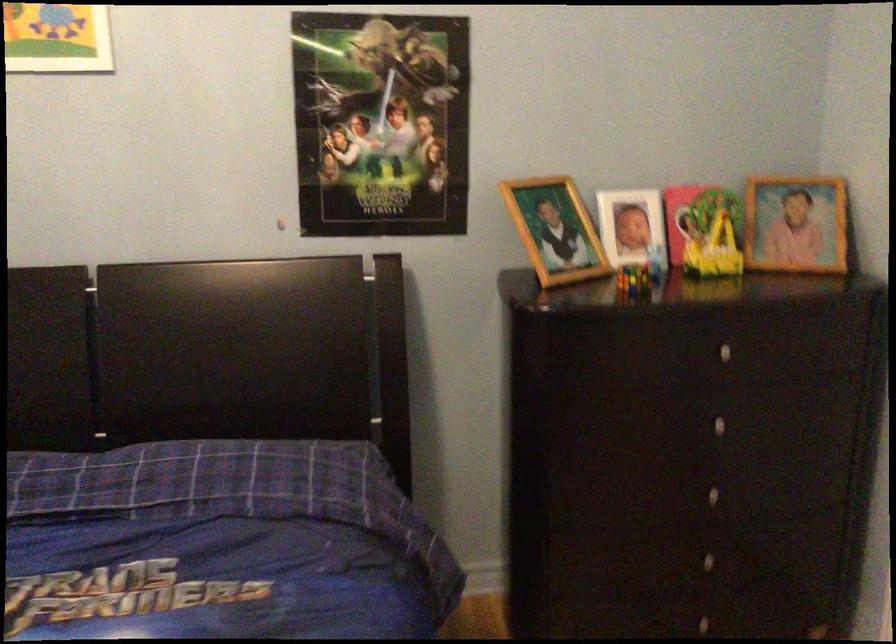
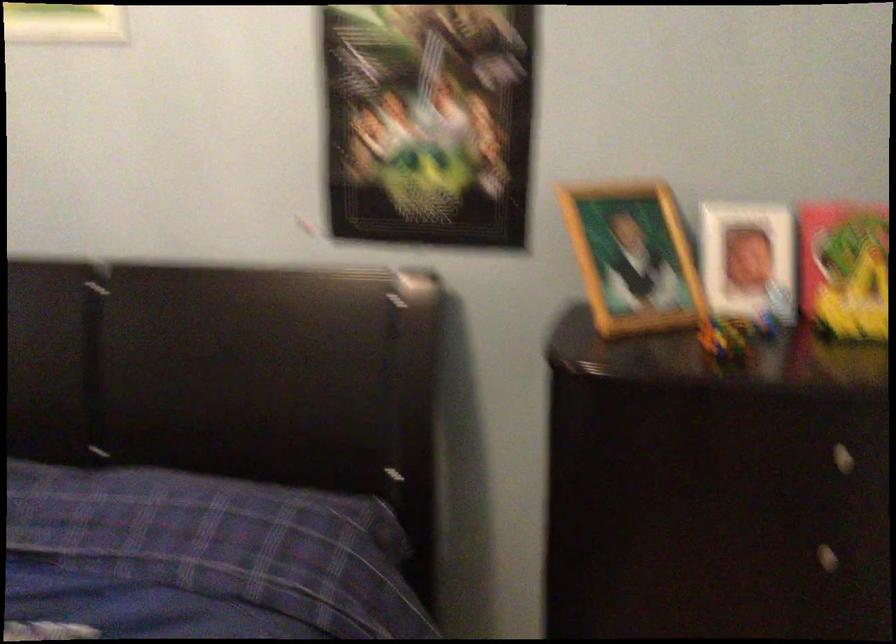
Where in the second image is the point corresponding to (727,353) from the first image?

(840, 458)